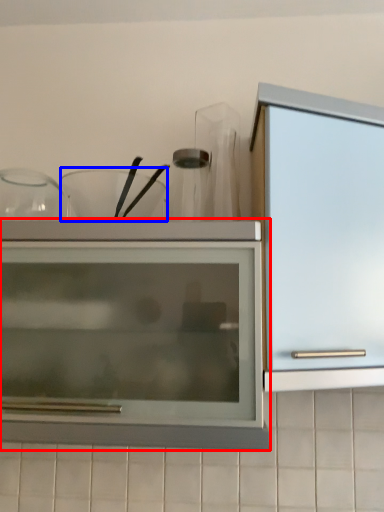
Question: Among these objects, which one is nearest to the camera, cupboard (highlighted by a red box) or tableware (highlighted by a blue box)?

Choices:
 (A) cupboard
 (B) tableware

Answer: (A)